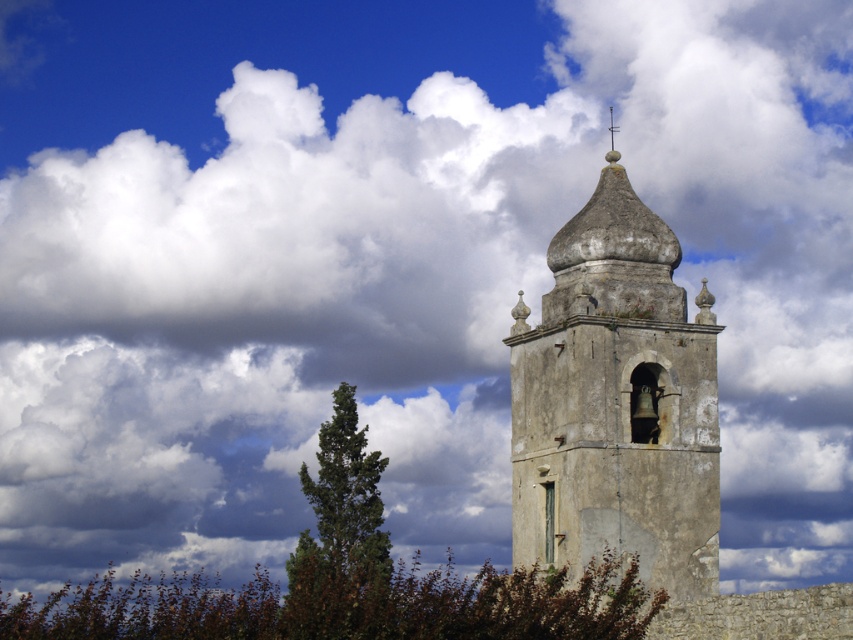
Question: Is brown textured tree at lower center wider than smooth stone spire at upper center?

Choices:
 (A) yes
 (B) no

Answer: (A)

Question: Does green textured tree at center-left appear on the right side of smooth stone spire at upper center?

Choices:
 (A) no
 (B) yes

Answer: (A)

Question: Which of the following is the farthest from the observer?

Choices:
 (A) green textured tree at center-left
 (B) weathered stone bell tower at center

Answer: (B)

Question: Does weathered stone bell tower at center lie behind smooth stone spire at upper center?

Choices:
 (A) no
 (B) yes

Answer: (A)

Question: Among these points, which one is farthest from the camera?

Choices:
 (A) (618, 125)
 (B) (183, 632)
 (C) (577, 212)
 (D) (329, 516)

Answer: (A)

Question: Which object is closer to the camera taking this photo?

Choices:
 (A) smooth stone spire at upper center
 (B) brown textured tree at lower center

Answer: (B)